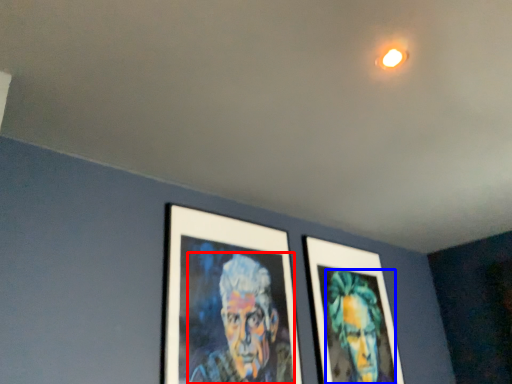
Question: Among these objects, which one is farthest to the camera, person (highlighted by a red box) or person (highlighted by a blue box)?

Choices:
 (A) person
 (B) person

Answer: (B)